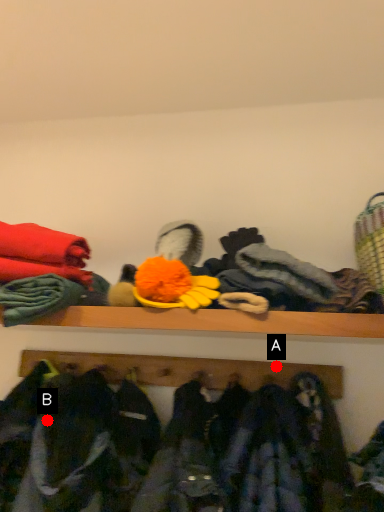
Question: Two points are circled on the image, labeled by A and B beside each circle. Which point appears farthest from the camera in this image?

Choices:
 (A) A is further
 (B) B is further

Answer: (A)